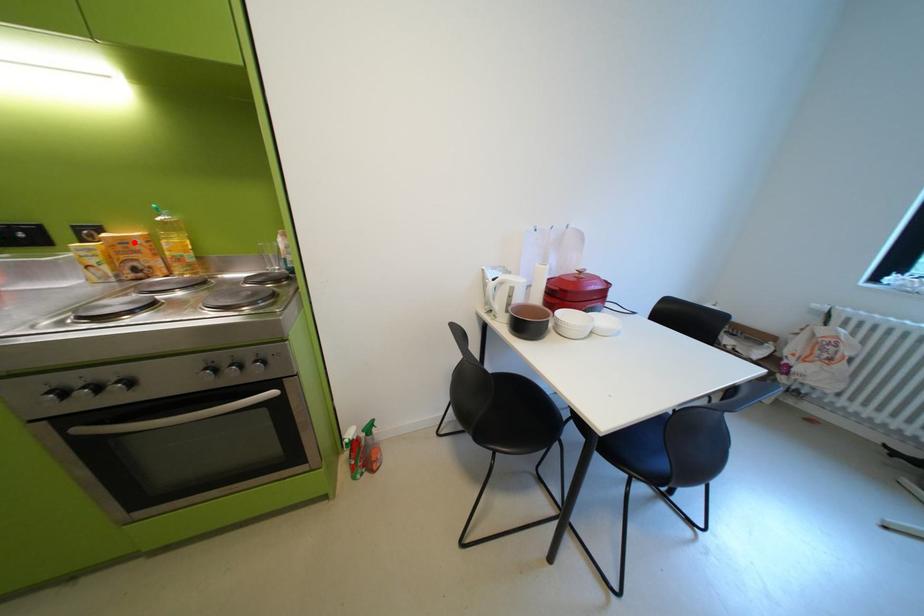
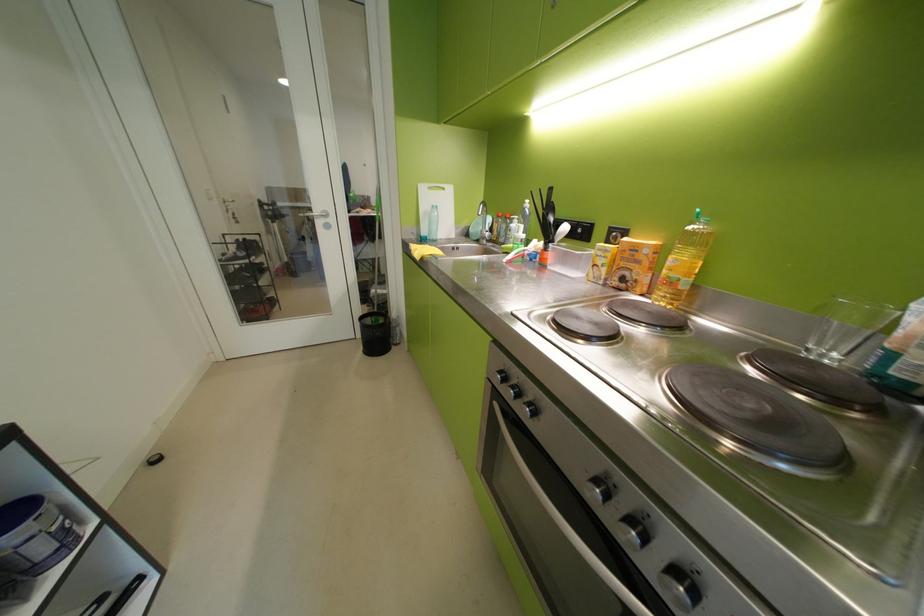
In the second image, find the point that corresponds to the highlighted location in the first image.

(646, 249)